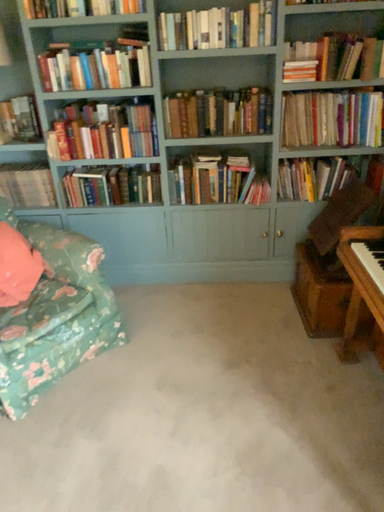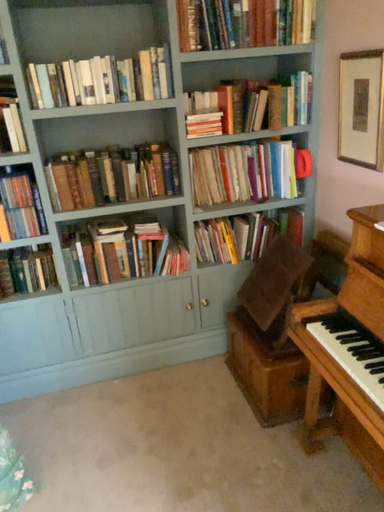
Question: Which way did the camera rotate in the video?

Choices:
 (A) rotated right
 (B) rotated left

Answer: (A)